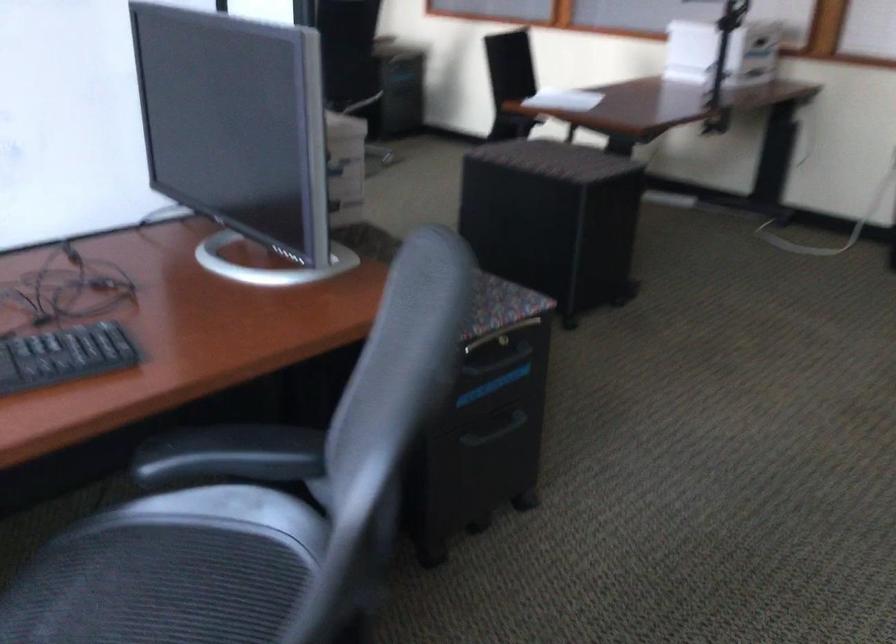
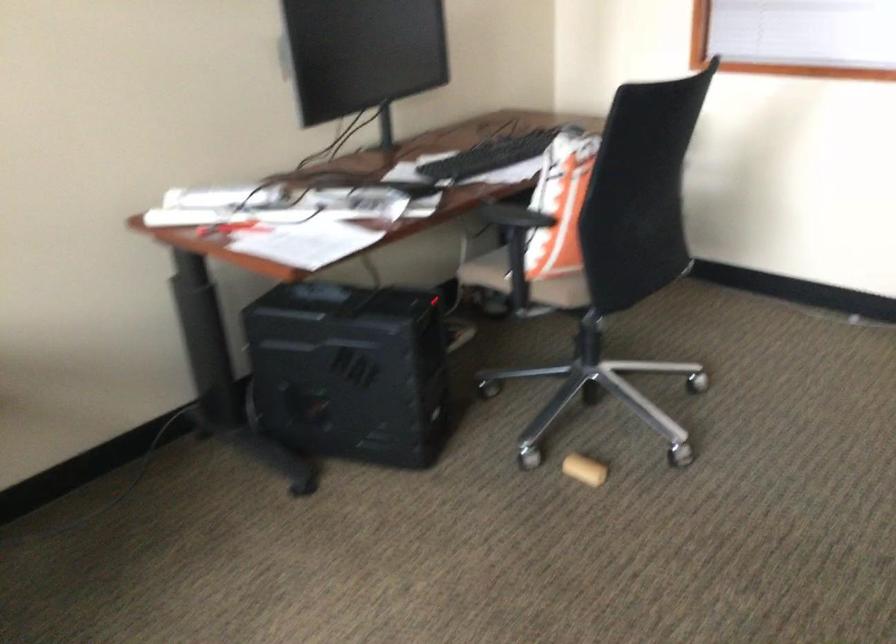
Which direction would the cameraman need to move to produce the second image?

The movement direction of the cameraman is left, forward.